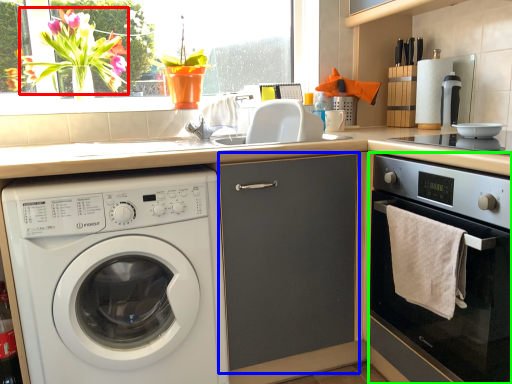
Question: Considering the real-world distances, which object is farthest from flower (highlighted by a red box)? screen door (highlighted by a blue box) or oven (highlighted by a green box)?

Choices:
 (A) screen door
 (B) oven

Answer: (B)